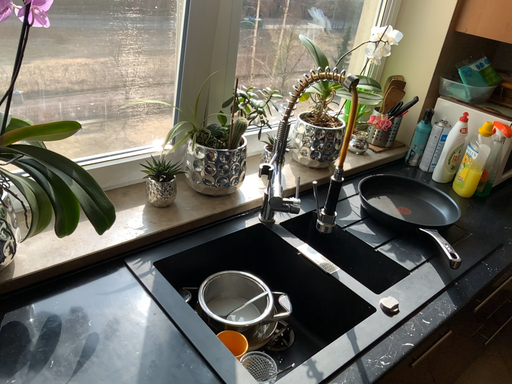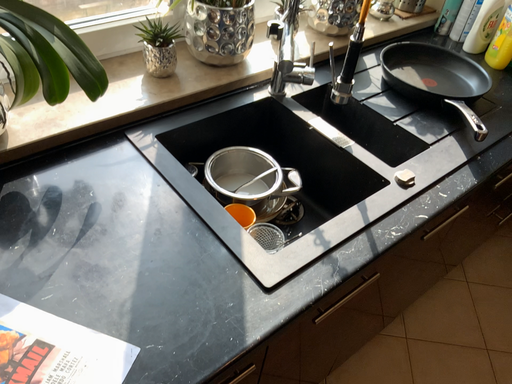
Question: How did the camera likely rotate when shooting the video?

Choices:
 (A) rotated upward
 (B) rotated downward

Answer: (B)